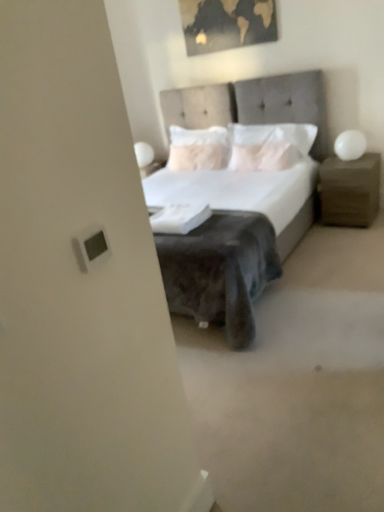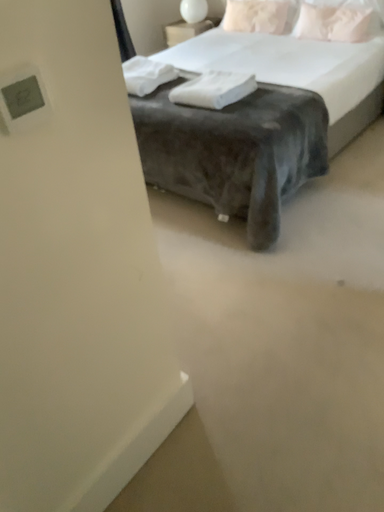
Question: How did the camera likely rotate when shooting the video?

Choices:
 (A) rotated downward
 (B) rotated upward

Answer: (A)